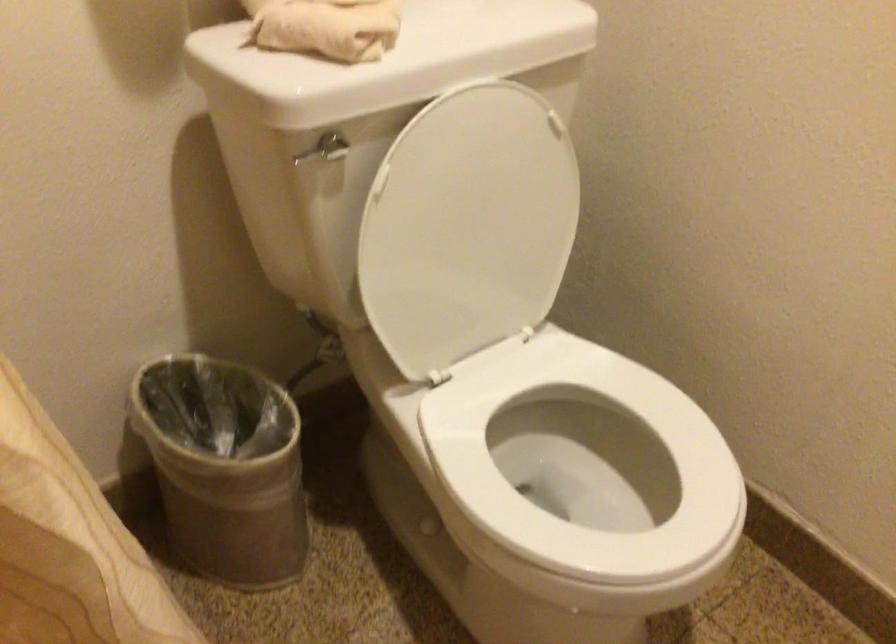
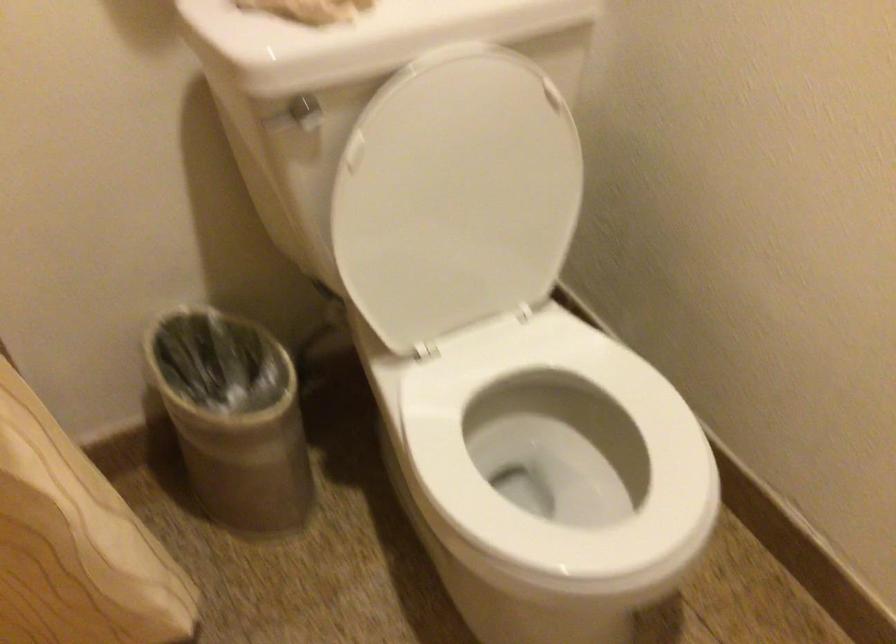
Question: The camera is either moving clockwise (left) or counter-clockwise (right) around the object. The first image is from the beginning of the video and the second image is from the end. Is the camera moving left or right when shooting the video?

Choices:
 (A) Left
 (B) Right

Answer: (B)